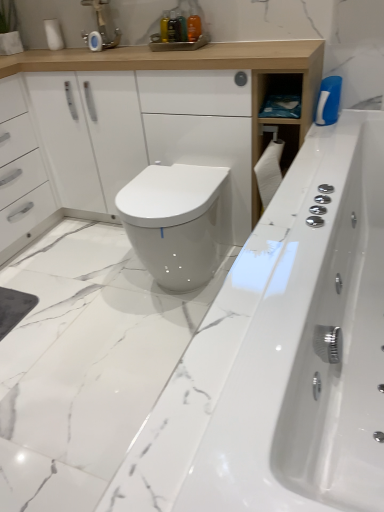
Question: Is white matte toilet paper at upper left wider or thinner than matte silver faucet at upper center?

Choices:
 (A) thin
 (B) wide

Answer: (A)

Question: Considering their positions, is white matte toilet paper at upper left located in front of or behind matte silver faucet at upper center?

Choices:
 (A) front
 (B) behind

Answer: (B)

Question: Which object is positioned closest to the white glossy cabinet at upper center?

Choices:
 (A) white glossy bidet at center
 (B) white matte toilet paper at upper left
 (C) white glossy bathtub at center
 (D) matte silver faucet at upper center

Answer: (D)

Question: Which object is the farthest from the white matte toilet paper at upper left?

Choices:
 (A) white glossy bidet at center
 (B) white glossy bathtub at center
 (C) matte silver faucet at upper center
 (D) white glossy cabinet at upper center

Answer: (B)